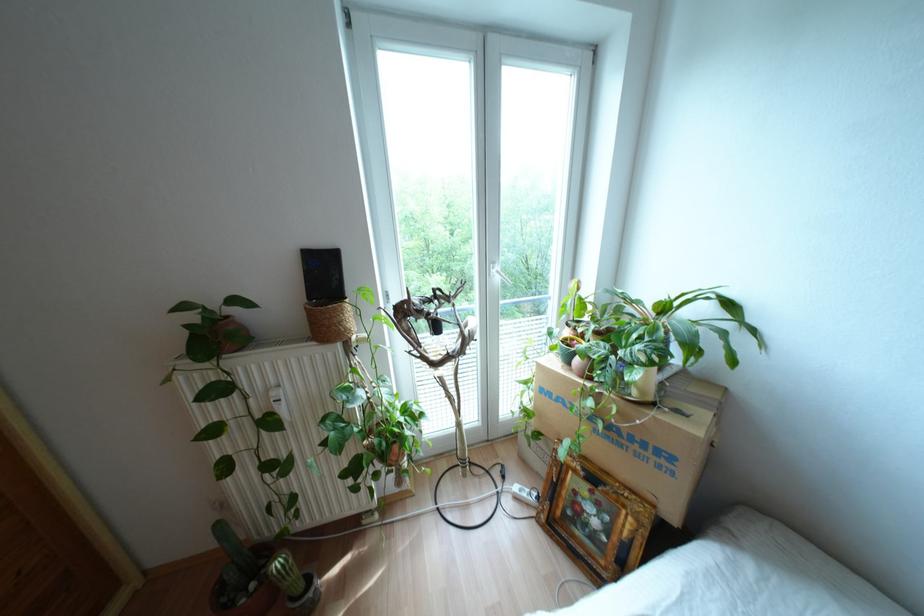
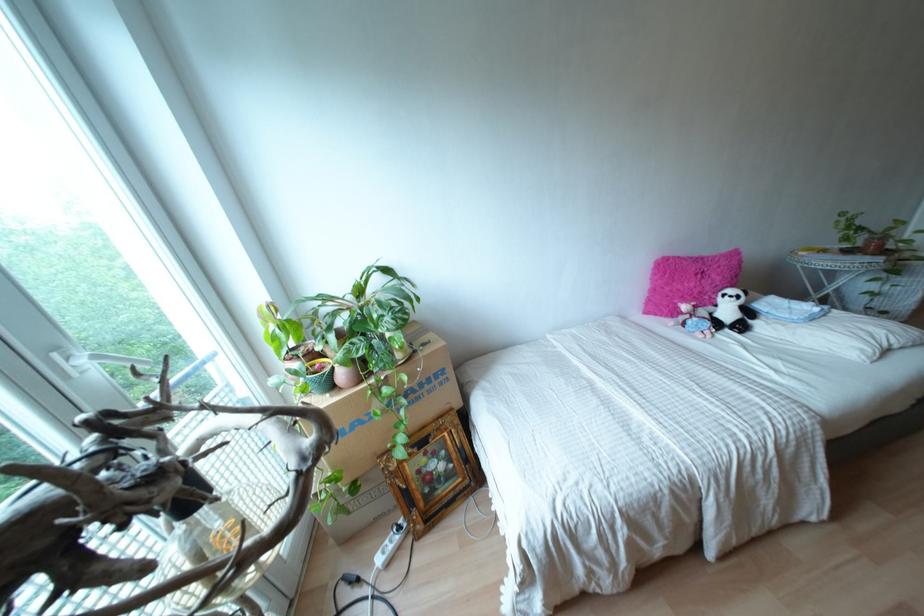
Find the pixel in the second image that matches (x=642, y=445) in the first image.

(428, 379)